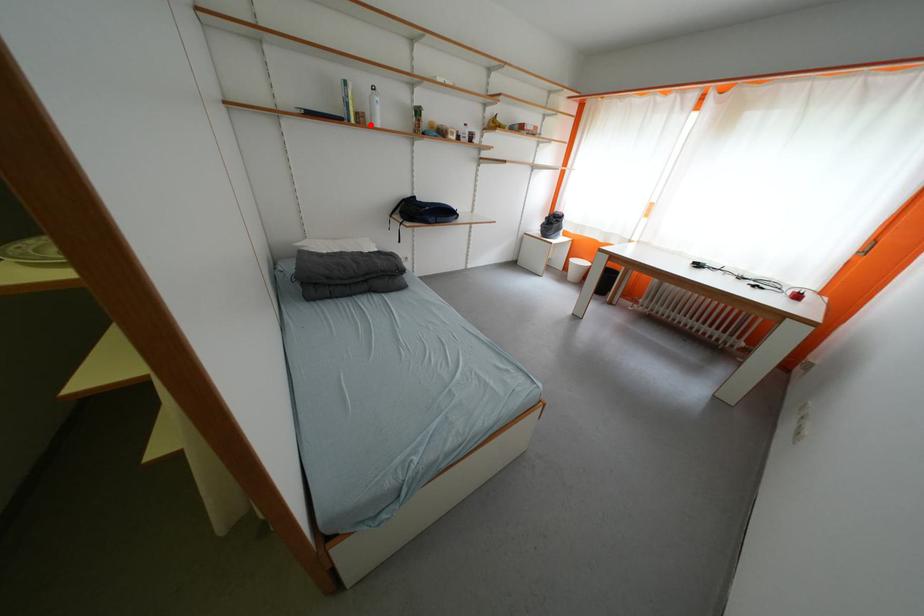
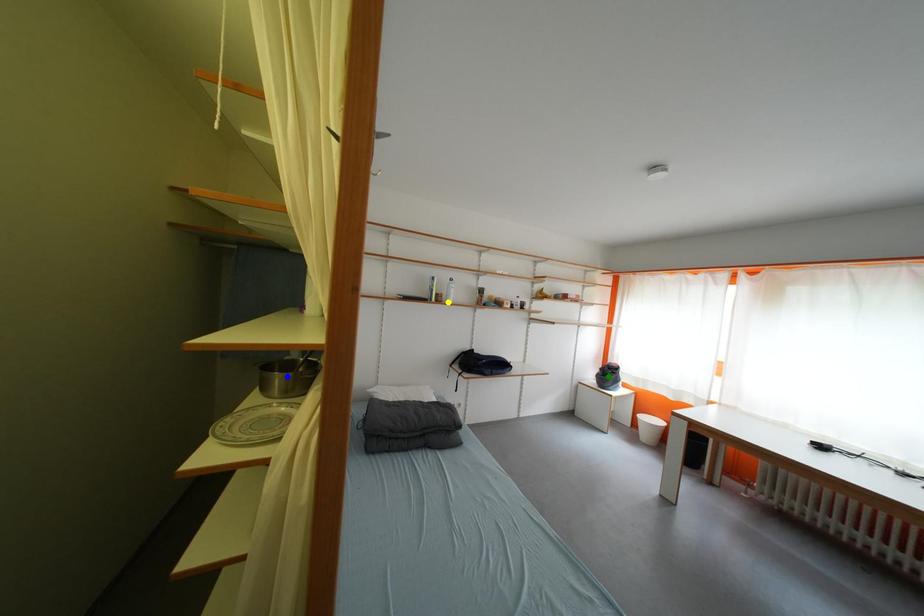
Question: I am providing you with two images of the same scene from different viewpoints. A red point is marked on the first image. You are given multiple points on the second image. Which point in image 2 represents the same 3d spot as the red point in image 1?

Choices:
 (A) yellow point
 (B) green point
 (C) blue point

Answer: (A)